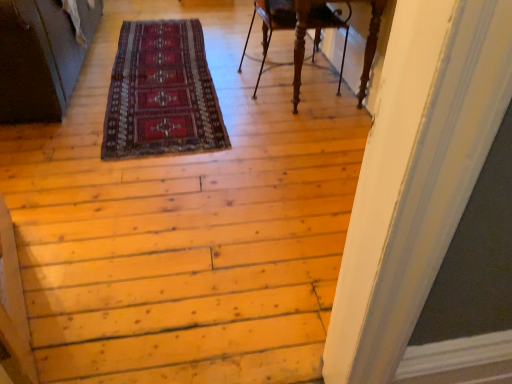
Looking at this image, what is the approximate width of wooden carved chair at upper center?

It is 19.40 inches.

Measure the distance between wooden carved chair at upper center and camera.

wooden carved chair at upper center is 2.23 meters from camera.

I want to click on wooden carved chair at upper center, so click(x=271, y=25).

What do you see at coordinates (271, 25) in the screenshot?
I see `wooden carved chair at upper center` at bounding box center [271, 25].

Measure the distance between point (281, 17) and camera.

8.35 feet.

What do you see at coordinates (161, 93) in the screenshot? I see `red woolen rug at center` at bounding box center [161, 93].

At what (x,y) coordinates should I click in order to perform the action: click on red woolen rug at center. Please return your answer as a coordinate pair (x, y). Looking at the image, I should click on (161, 93).

Locate an element on the screen. wooden carved chair at upper center is located at coordinates (271, 25).

Is wooden carved chair at upper center at the right side of red woolen rug at center?

Yes.

Considering their positions, is wooden carved chair at upper center located in front of or behind red woolen rug at center?

wooden carved chair at upper center is positioned farther from the viewer than red woolen rug at center.

Does point (278, 22) appear closer or farther from the camera than point (181, 104)?

Point (278, 22) is positioned farther from the camera compared to point (181, 104).

From the image's perspective, which one is positioned lower, wooden carved chair at upper center or red woolen rug at center?

From the image's view, red woolen rug at center is below.

From a real-world perspective, which object stands above the other?

wooden carved chair at upper center, from a real-world perspective.

In terms of width, does wooden carved chair at upper center look wider or thinner when compared to red woolen rug at center?

Considering their sizes, wooden carved chair at upper center looks slimmer than red woolen rug at center.

Who is shorter, wooden carved chair at upper center or red woolen rug at center?

Standing shorter between the two is red woolen rug at center.

Who is smaller, wooden carved chair at upper center or red woolen rug at center?

red woolen rug at center is smaller.

Can we say wooden carved chair at upper center lies outside red woolen rug at center?

Indeed, wooden carved chair at upper center is completely outside red woolen rug at center.

Is wooden carved chair at upper center not close to red woolen rug at center?

They are positioned close to each other.

Could you tell me if wooden carved chair at upper center is turned towards red woolen rug at center?

No, wooden carved chair at upper center is not turned towards red woolen rug at center.

Locate an element on the screen. mat on the left of wooden carved chair at upper center is located at coordinates (161, 93).

Is red woolen rug at center at the right side of wooden carved chair at upper center?

No.

Is the position of red woolen rug at center more distant than that of wooden carved chair at upper center?

No, it is not.

Is point (151, 28) farther from viewer compared to point (277, 16)?

Yes, it is behind point (277, 16).

From the image's perspective, would you say red woolen rug at center is shown under wooden carved chair at upper center?

Yes, from the image's perspective, red woolen rug at center is below wooden carved chair at upper center.

From a real-world perspective, who is located higher, red woolen rug at center or wooden carved chair at upper center?

wooden carved chair at upper center.

In terms of width, does red woolen rug at center look wider or thinner when compared to wooden carved chair at upper center?

red woolen rug at center is wider than wooden carved chair at upper center.

In terms of height, does red woolen rug at center look taller or shorter compared to wooden carved chair at upper center?

Clearly, red woolen rug at center is shorter compared to wooden carved chair at upper center.

Consider the image. Between red woolen rug at center and wooden carved chair at upper center, which one has larger size?

wooden carved chair at upper center is bigger.

Would you say red woolen rug at center is inside or outside wooden carved chair at upper center?

red woolen rug at center is spatially situated outside wooden carved chair at upper center.

Is red woolen rug at center directly adjacent to wooden carved chair at upper center?

red woolen rug at center is not next to wooden carved chair at upper center, and they're not touching.

Could you tell me if red woolen rug at center is turned towards wooden carved chair at upper center?

No, red woolen rug at center does not turn towards wooden carved chair at upper center.

What's the angular difference between red woolen rug at center and wooden carved chair at upper center's facing directions?

They differ by 91.4 degrees in their facing directions.

The height and width of the screenshot is (384, 512). I want to click on mat below the wooden carved chair at upper center (from the image's perspective), so click(x=161, y=93).

Locate an element on the screen. The height and width of the screenshot is (384, 512). chair located above the red woolen rug at center (from a real-world perspective) is located at coordinates (x=271, y=25).

Find the location of a particular element. chair behind the red woolen rug at center is located at coordinates (271, 25).